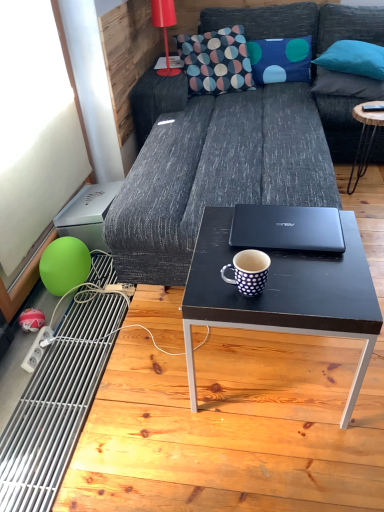
Find the location of a particular element. The width and height of the screenshot is (384, 512). vacant space in front of black matte laptop at center is located at coordinates (307, 283).